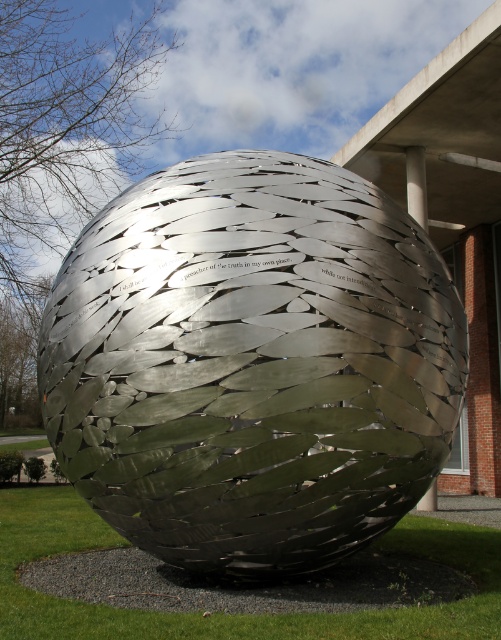
You are standing in front of the sculpture and want to place a small flag at each of the two points, point [137,310] and point [135,634]. Which point is closer to you so that you can place the flag without needing to move closer?

Point [137,310] is closer to you than point [135,634], so you can place the flag at point [137,310] without needing to move closer.

You are a gardener who wants to mow the green grass at center without damaging the metallic silver sphere at center. Can you safely mow the grass around the sphere?

The metallic silver sphere at center is taller than green grass at center, so you can safely mow the green grass at center without hitting the sphere.

You are a landscape architect designing a garden around the metallic silver sphere at center and the green grass at center. If you need to install a circular walkway with a diameter of 2 meters around both objects, will there be enough space between them to accommodate the walkway?

The metallic silver sphere at center and green grass at center are 2.20 meters apart. A circular walkway with a diameter of 2 meters has a radius of 1 meter. The total required distance between the two objects would be 2 meters combined radius, so 2.20 meters is sufficient. Yes, the walkway can be installed between them.